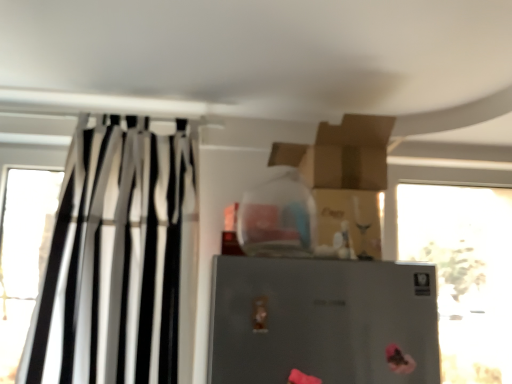
Question: Is transparent glass bottle at upper center placed right next to transparent glass window at right?

Choices:
 (A) no
 (B) yes

Answer: (A)

Question: Is transparent glass bottle at upper center oriented away from transparent glass window at right?

Choices:
 (A) yes
 (B) no

Answer: (B)

Question: Would you consider transparent glass bottle at upper center to be distant from transparent glass window at right?

Choices:
 (A) no
 (B) yes

Answer: (B)

Question: Considering the relative sizes of transparent glass bottle at upper center and transparent glass window at right in the image provided, is transparent glass bottle at upper center bigger than transparent glass window at right?

Choices:
 (A) no
 (B) yes

Answer: (A)

Question: From the image's perspective, would you say transparent glass bottle at upper center is positioned over transparent glass window at right?

Choices:
 (A) yes
 (B) no

Answer: (A)

Question: Is transparent glass bottle at upper center positioned behind transparent glass window at right?

Choices:
 (A) yes
 (B) no

Answer: (B)

Question: Is satin silver refrigerator at center wider than transparent glass window at right?

Choices:
 (A) yes
 (B) no

Answer: (B)

Question: Is satin silver refrigerator at center thinner than transparent glass window at right?

Choices:
 (A) no
 (B) yes

Answer: (B)

Question: Does satin silver refrigerator at center have a smaller size compared to transparent glass window at right?

Choices:
 (A) yes
 (B) no

Answer: (A)

Question: Is satin silver refrigerator at center at the left side of transparent glass window at right?

Choices:
 (A) no
 (B) yes

Answer: (B)

Question: From a real-world perspective, is satin silver refrigerator at center on transparent glass window at right?

Choices:
 (A) no
 (B) yes

Answer: (A)

Question: Would you consider satin silver refrigerator at center to be distant from transparent glass window at right?

Choices:
 (A) yes
 (B) no

Answer: (A)

Question: From the image's perspective, is black/white striped curtain at left on top of satin silver refrigerator at center?

Choices:
 (A) yes
 (B) no

Answer: (A)